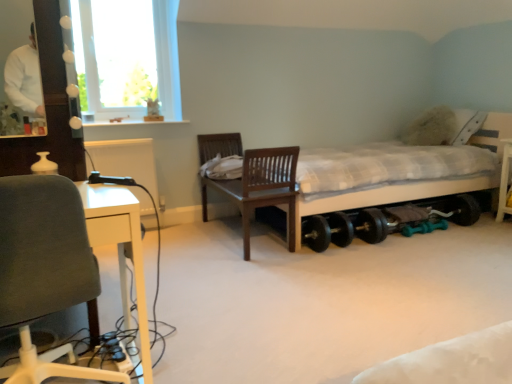
Find the location of `vacant space in front of black rubber wheel at lower center`. vacant space in front of black rubber wheel at lower center is located at coordinates (442, 238).